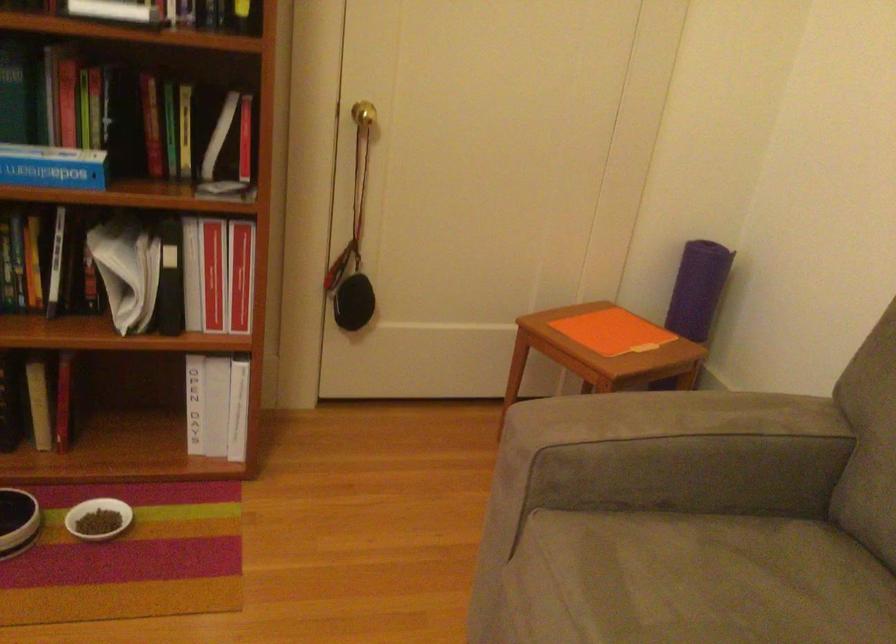
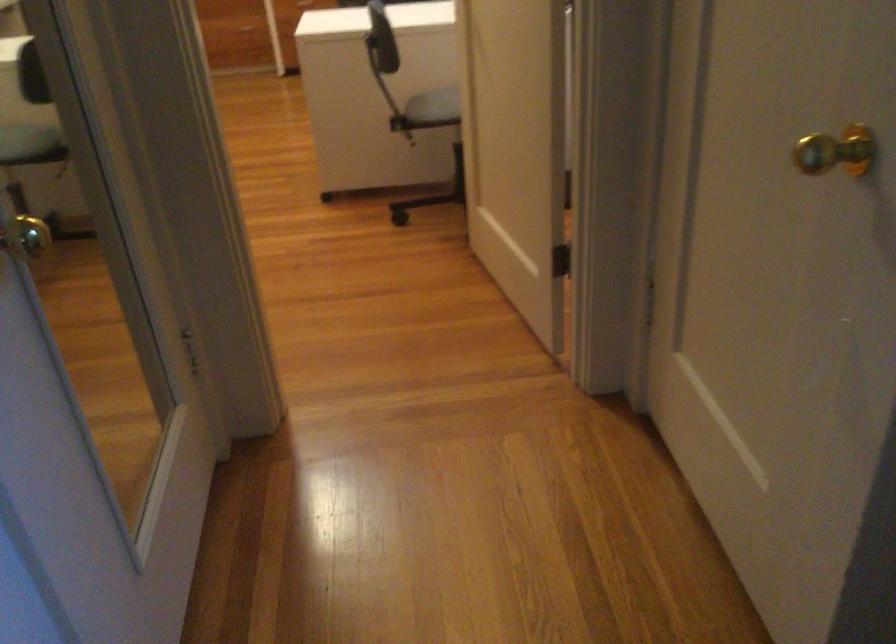
Question: I am providing you with two images of the same scene from different viewpoints. Which of the following objects are not visible in image2?

Choices:
 (A) printer side handle
 (B) chair sitting surface
 (C) white pet bowl
 (D) black chair armrest

Answer: (C)